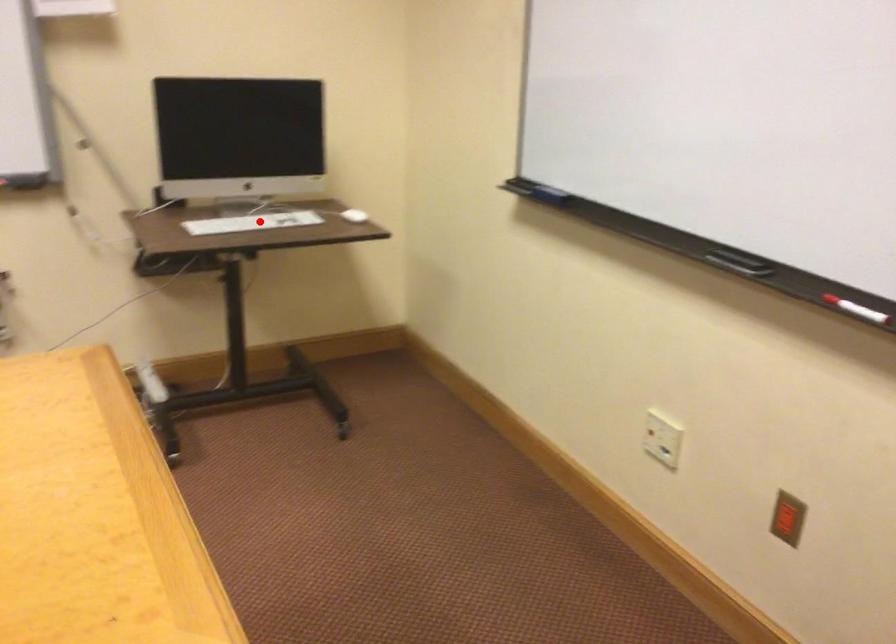
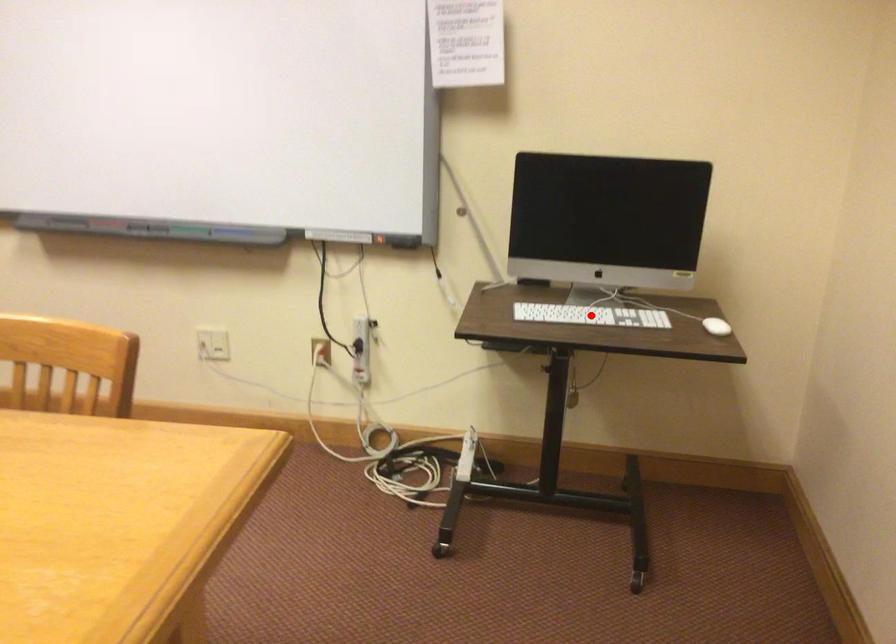
I am providing you with two images of the same scene from different viewpoints. A red point is marked on the first image and another point is marked on the second image. Do the highlighted points in image1 and image2 indicate the same real-world spot?

Yes